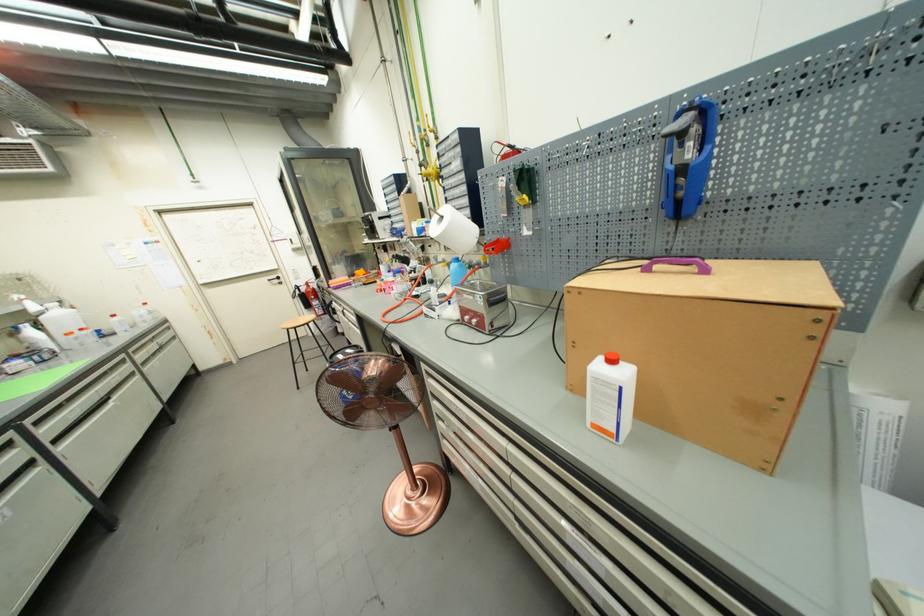
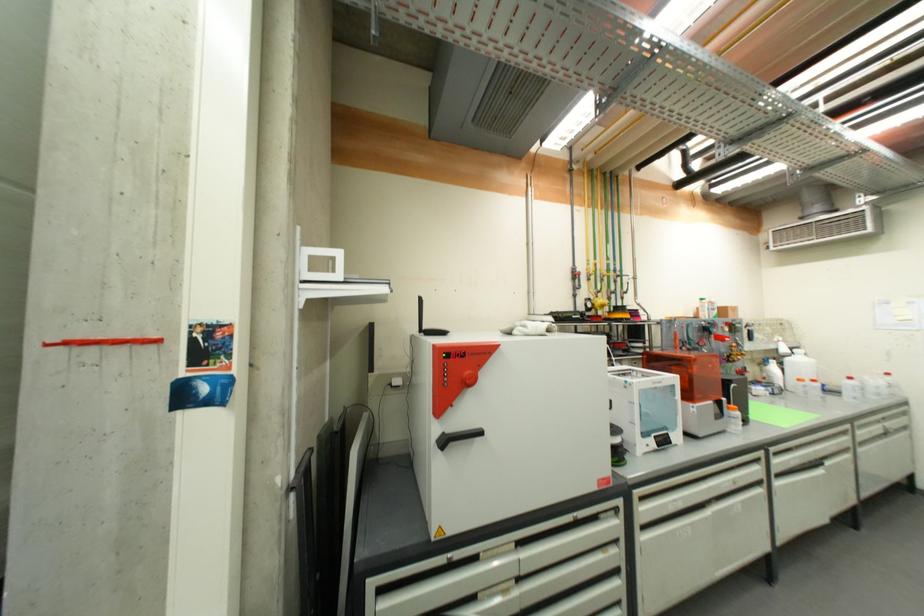
Locate, in the second image, the point that corresponds to the point at 37,345 in the first image.

(774, 378)